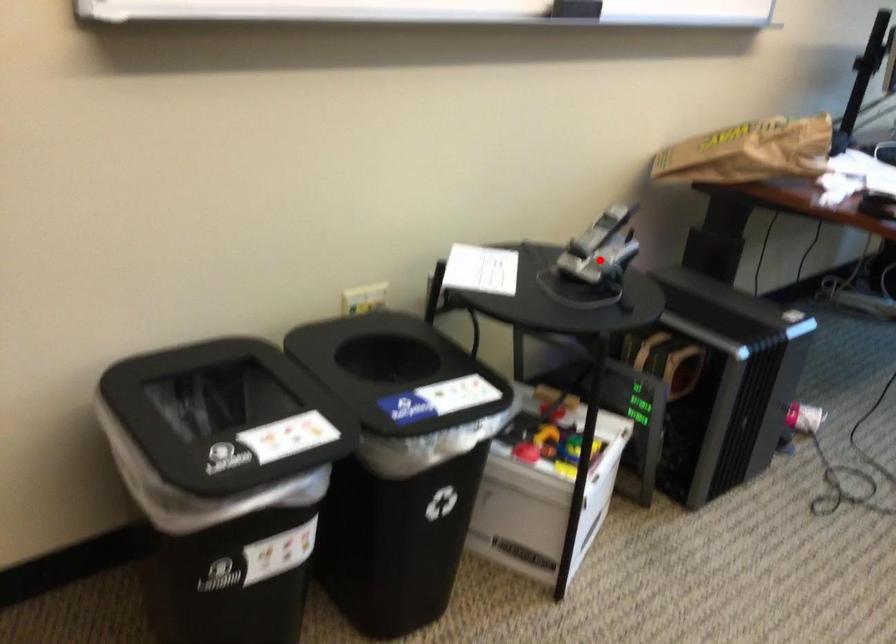
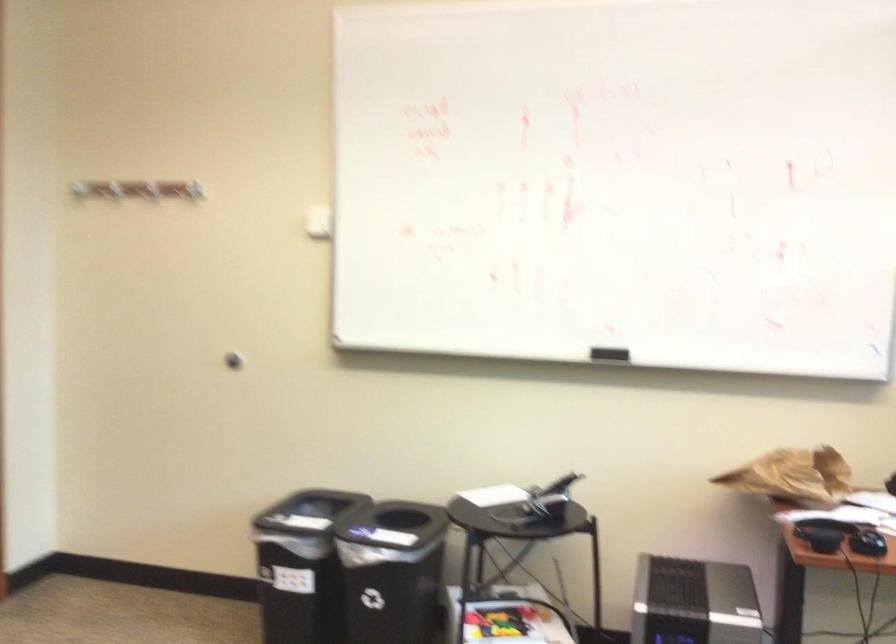
Question: A red point is marked in image1. In image2, is the corresponding 3D point closer to the camera or farther? Reply with the corresponding letter.

Choices:
 (A) The corresponding 3D point is closer.
 (B) The corresponding 3D point is farther.

Answer: (B)